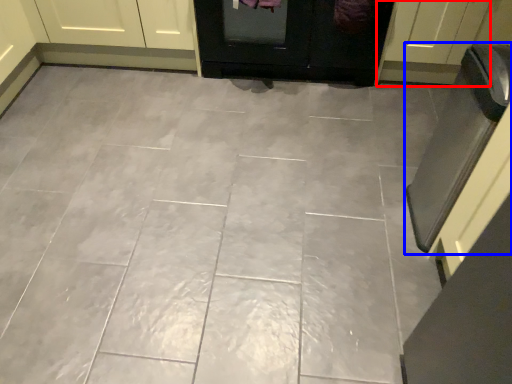
Question: Which point is further to the camera, door (highlighted by a red box) or oven (highlighted by a blue box)?

Choices:
 (A) door
 (B) oven

Answer: (A)